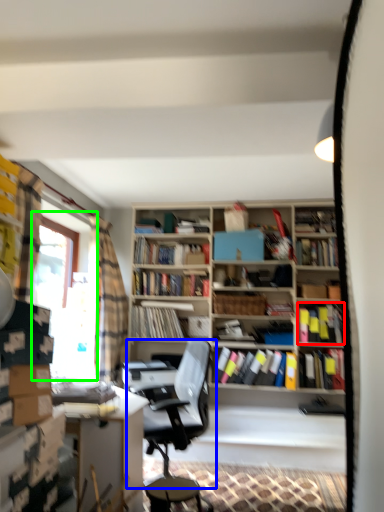
Question: Which object is positioned closest to book (highlighted by a red box)? Select from chair (highlighted by a blue box) and window screen (highlighted by a green box).

Choices:
 (A) chair
 (B) window screen

Answer: (A)